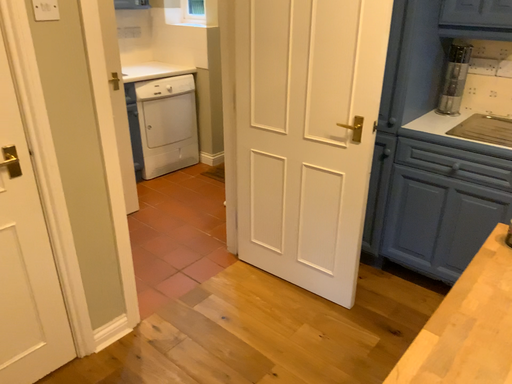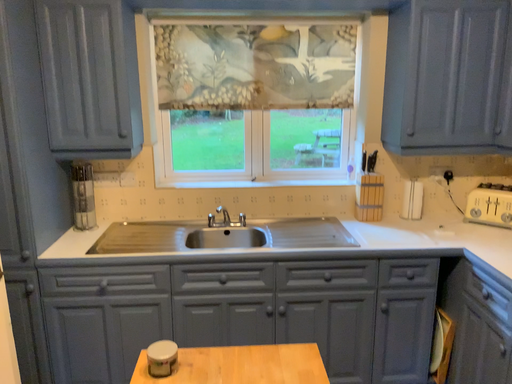
Question: How did the camera likely rotate when shooting the video?

Choices:
 (A) rotated left
 (B) rotated right

Answer: (B)